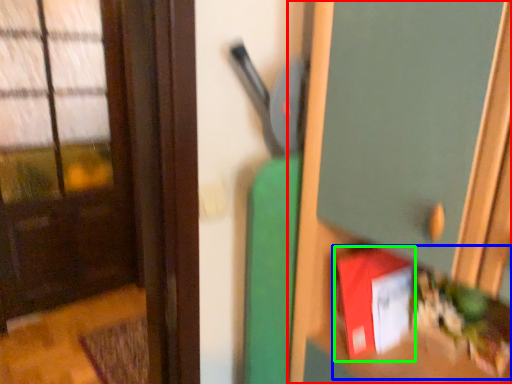
Question: Which object is the closest to the dresser (highlighted by a red box)? Choose among these: book (highlighted by a blue box) or book (highlighted by a green box).

Choices:
 (A) book
 (B) book

Answer: (A)